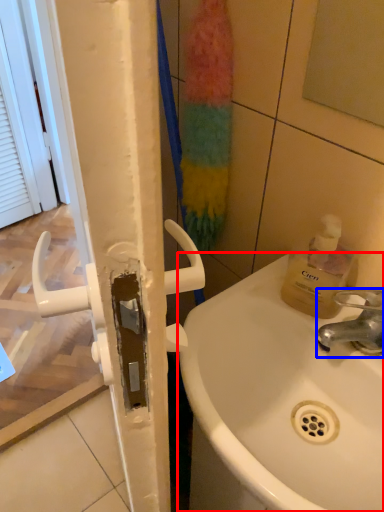
Question: Among these objects, which one is farthest to the camera, sink (highlighted by a red box) or tap (highlighted by a blue box)?

Choices:
 (A) sink
 (B) tap

Answer: (B)